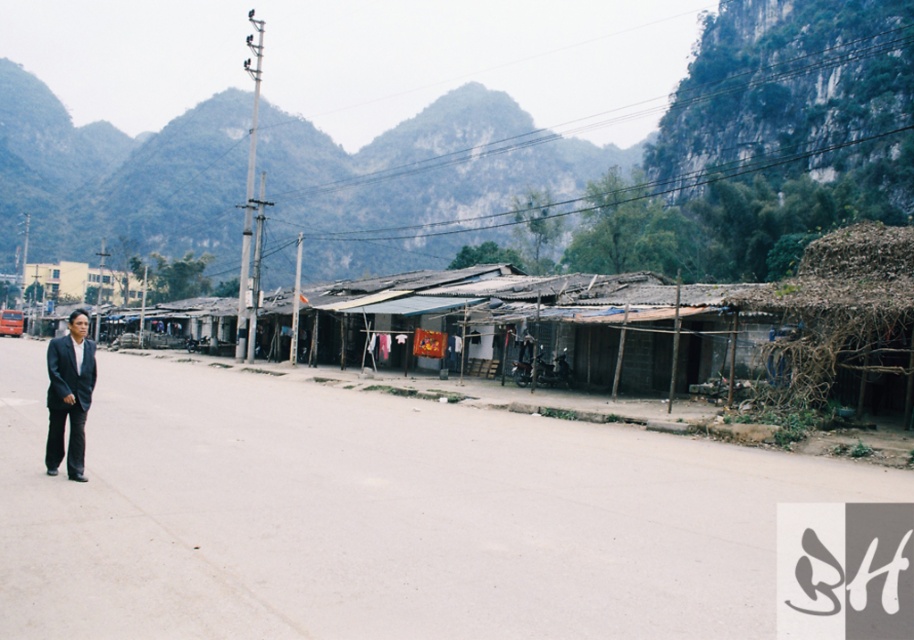
Question: Can you confirm if green rocky mountain at upper center is positioned below matte black suit at left?

Choices:
 (A) yes
 (B) no

Answer: (B)

Question: Is green rocky mountain at upper center closer to camera compared to matte black suit at left?

Choices:
 (A) yes
 (B) no

Answer: (B)

Question: Which point is farther from the camera taking this photo?

Choices:
 (A) (66, 392)
 (B) (266, 170)

Answer: (B)

Question: Is the position of green rocky mountain at upper center less distant than that of matte black suit at left?

Choices:
 (A) yes
 (B) no

Answer: (B)